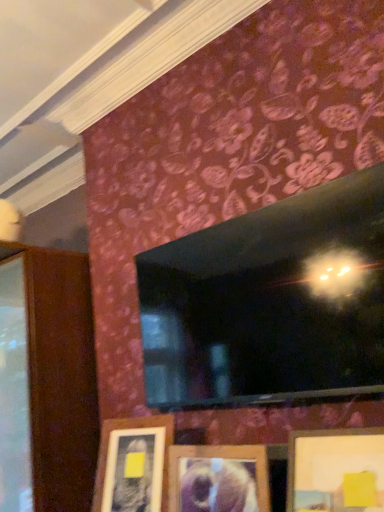
Question: Is wooden picture frame at lower center, which ranks as the 3th picture frame in left-to-right order, to the left of wooden picture frame at lower center, the 3th picture frame viewed from the right, from the viewer's perspective?

Choices:
 (A) no
 (B) yes

Answer: (A)

Question: Considering the relative sizes of wooden picture frame at lower center, the first picture frame viewed from the right, and wooden picture frame at lower center, the 3th picture frame viewed from the right, in the image provided, is wooden picture frame at lower center, the first picture frame viewed from the right, thinner than wooden picture frame at lower center, the 3th picture frame viewed from the right,?

Choices:
 (A) yes
 (B) no

Answer: (B)

Question: Considering the relative sizes of wooden picture frame at lower center, the first picture frame viewed from the right, and wooden picture frame at lower center, which is the first picture frame in left-to-right order, in the image provided, is wooden picture frame at lower center, the first picture frame viewed from the right, shorter than wooden picture frame at lower center, which is the first picture frame in left-to-right order,?

Choices:
 (A) no
 (B) yes

Answer: (B)

Question: Is wooden picture frame at lower center, which ranks as the 3th picture frame in left-to-right order, with wooden picture frame at lower center, which is the first picture frame in left-to-right order?

Choices:
 (A) no
 (B) yes

Answer: (A)

Question: Does wooden picture frame at lower center, which ranks as the 3th picture frame in left-to-right order, appear on the right side of wooden picture frame at lower center, which is the first picture frame in left-to-right order?

Choices:
 (A) no
 (B) yes

Answer: (B)

Question: Relative to wooden picture frame at lower center, which ranks as the 3th picture frame in left-to-right order, is wooden picture frame at lower center, the 3th picture frame viewed from the right, in front or behind?

Choices:
 (A) behind
 (B) front

Answer: (A)

Question: Would you say wooden picture frame at lower center, the 3th picture frame viewed from the right, is inside or outside wooden picture frame at lower center, which ranks as the 3th picture frame in left-to-right order?

Choices:
 (A) outside
 (B) inside

Answer: (A)

Question: Is point (167, 420) positioned closer to the camera than point (292, 462)?

Choices:
 (A) closer
 (B) farther

Answer: (B)

Question: Looking at their shapes, would you say wooden picture frame at lower center, the 3th picture frame viewed from the right, is wider or thinner than wooden picture frame at lower center, which ranks as the 3th picture frame in left-to-right order?

Choices:
 (A) wide
 (B) thin

Answer: (B)

Question: Is wooden picture frame at lower center, which ranks as the 3th picture frame in left-to-right order, inside or outside of wooden picture frame at lower center, which is the first picture frame in left-to-right order?

Choices:
 (A) inside
 (B) outside

Answer: (B)

Question: Looking at their shapes, would you say wooden picture frame at lower center, which ranks as the 3th picture frame in left-to-right order, is wider or thinner than wooden picture frame at lower center, which is the first picture frame in left-to-right order?

Choices:
 (A) wide
 (B) thin

Answer: (A)

Question: Would you say wooden picture frame at lower center, the first picture frame viewed from the right, is to the left or to the right of wooden picture frame at lower center, which is the first picture frame in left-to-right order, in the picture?

Choices:
 (A) right
 (B) left

Answer: (A)

Question: Considering the positions of wooden picture frame at lower center, which ranks as the 3th picture frame in left-to-right order, and wooden picture frame at lower center, the 3th picture frame viewed from the right, in the image, is wooden picture frame at lower center, which ranks as the 3th picture frame in left-to-right order, bigger or smaller than wooden picture frame at lower center, the 3th picture frame viewed from the right,?

Choices:
 (A) small
 (B) big

Answer: (A)

Question: In the image, is wooden picture frame at center, the second picture frame positioned from the right, positioned in front of or behind wooden picture frame at lower center, which ranks as the 3th picture frame in left-to-right order?

Choices:
 (A) front
 (B) behind

Answer: (B)

Question: Considering the relative positions of wooden picture frame at center, the second picture frame from the left, and wooden picture frame at lower center, which ranks as the 3th picture frame in left-to-right order, in the image provided, is wooden picture frame at center, the second picture frame from the left, to the left or to the right of wooden picture frame at lower center, which ranks as the 3th picture frame in left-to-right order,?

Choices:
 (A) left
 (B) right

Answer: (A)